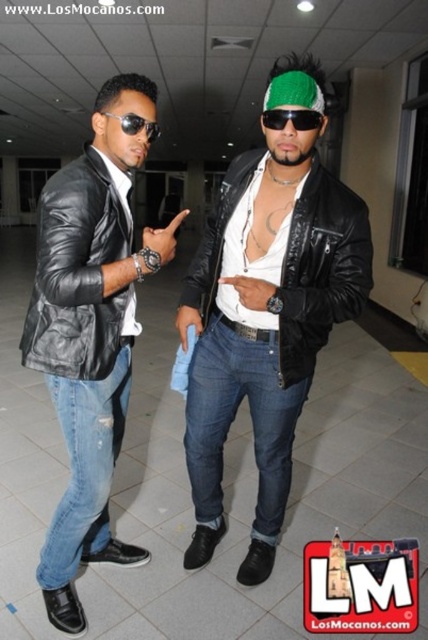
You are a fashion designer observing two black leather jackets in the scene. The jackets are labeled as the black leather jacket at center and the matte black leather jacket at left. Which one is bigger?

The black leather jacket at center is larger in size than the matte black leather jacket at left.